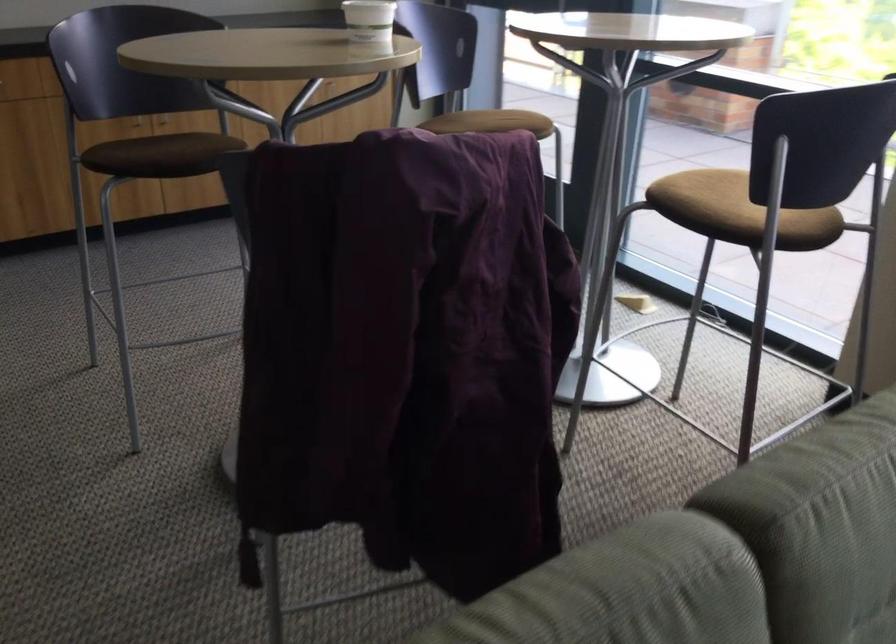
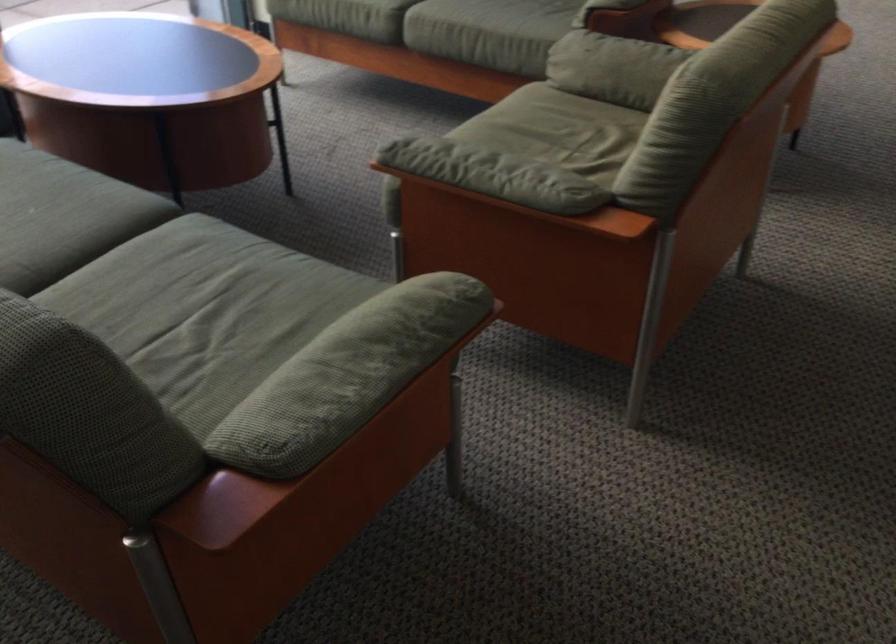
The first image is from the beginning of the video and the second image is from the end. How did the camera likely rotate when shooting the video?

The camera rotated toward right-down.